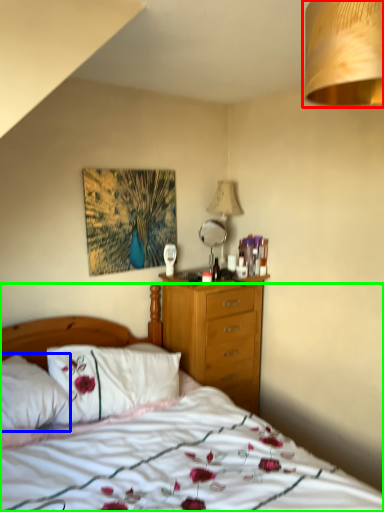
Question: Which object is positioned closest to lamp (highlighted by a red box)? Select from pillow (highlighted by a blue box) and bed (highlighted by a green box).

Choices:
 (A) pillow
 (B) bed

Answer: (B)